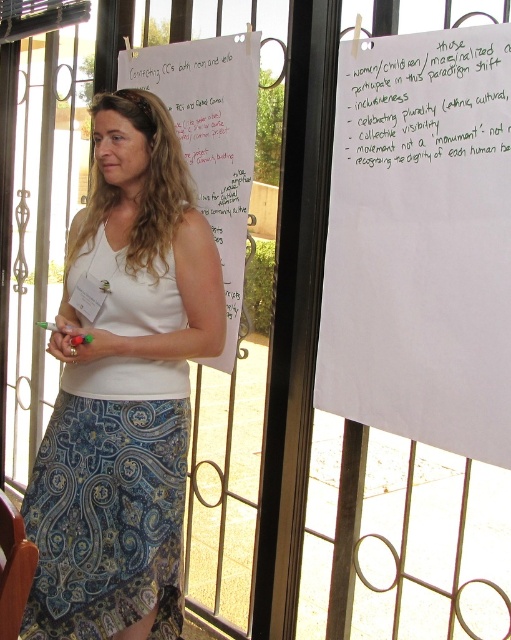
Which is behind, point (92, 252) or point (460, 96)?

The point (92, 252) is behind.

Does point (117, 225) come in front of point (476, 131)?

No, (117, 225) is further to viewer.

Does point (146, 324) come closer to viewer compared to point (475, 109)?

No, (146, 324) is further to viewer.

This screenshot has width=511, height=640. What are the coordinates of `white cotton tank top at center` in the screenshot? It's located at (124, 388).

Is point (409, 122) positioned before point (221, 193)?

That is True.

Based on the photo, does white paper at upper right have a larger size compared to white paper at center?

No, white paper at upper right is not bigger than white paper at center.

Who is more distant from viewer, (405, 100) or (157, 51)?

Point (157, 51)

The image size is (511, 640). I want to click on white paper at upper right, so click(427, 96).

Where is `white paper at upper center`? white paper at upper center is located at coordinates (421, 241).

Which is behind, point (433, 308) or point (450, 32)?

The point (433, 308) is behind.

The height and width of the screenshot is (640, 511). I want to click on white paper at upper center, so click(x=421, y=241).